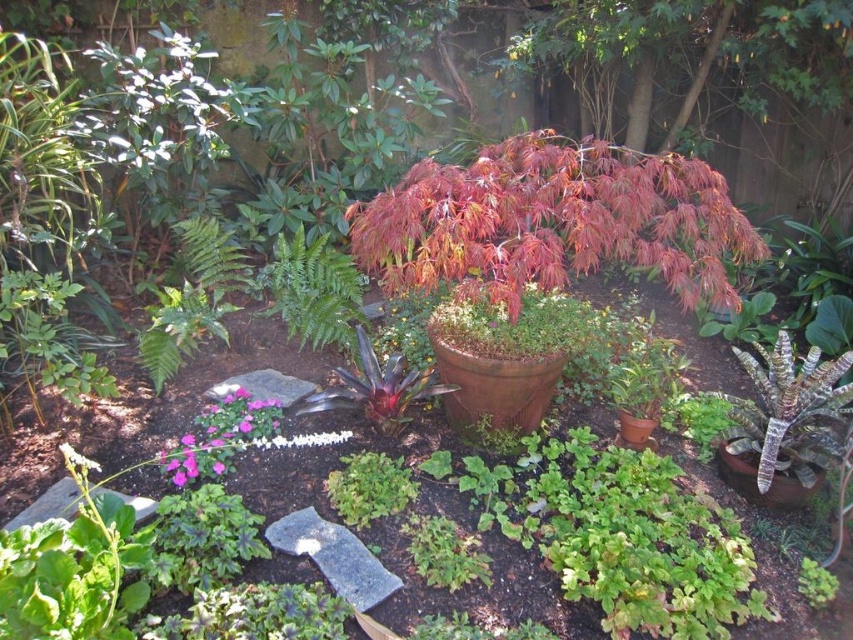
You are a gardener planning to move the shiny red maple at center and the matte brown pot at center to a new location. If you need to ensure both fit through a doorway that is 1 meter wide, will they fit side by side?

The shiny red maple at center has a width larger than the matte brown pot at center. Since the maple is wider, if its width alone exceeds 1 meter, they won

You are standing in the garden and want to water the terracotta pot at center. If your watering can has a maximum reach of 2 meters, can you water it without moving closer?

The terracotta pot at center is 2.56 meters from the viewer. Since the watering can only reaches up to 2 meters, you cannot water it without moving closer.

You are standing in the garden and want to locate the shiny red maple at center. Based on the coordinate system where the bottom left corner is the origin, can you tell me its exact position?

The shiny red maple at center is located at the coordinate point of (553, 221).